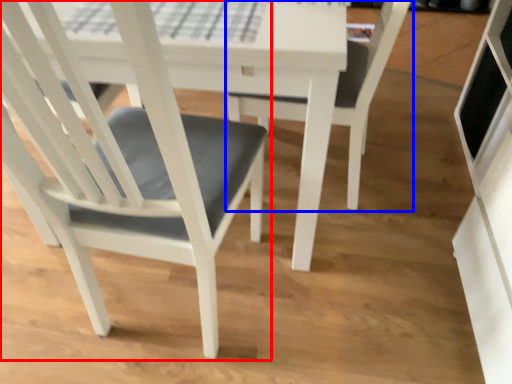
Question: Which object appears closest to the camera in this image, chair (highlighted by a red box) or chair (highlighted by a blue box)?

Choices:
 (A) chair
 (B) chair

Answer: (A)